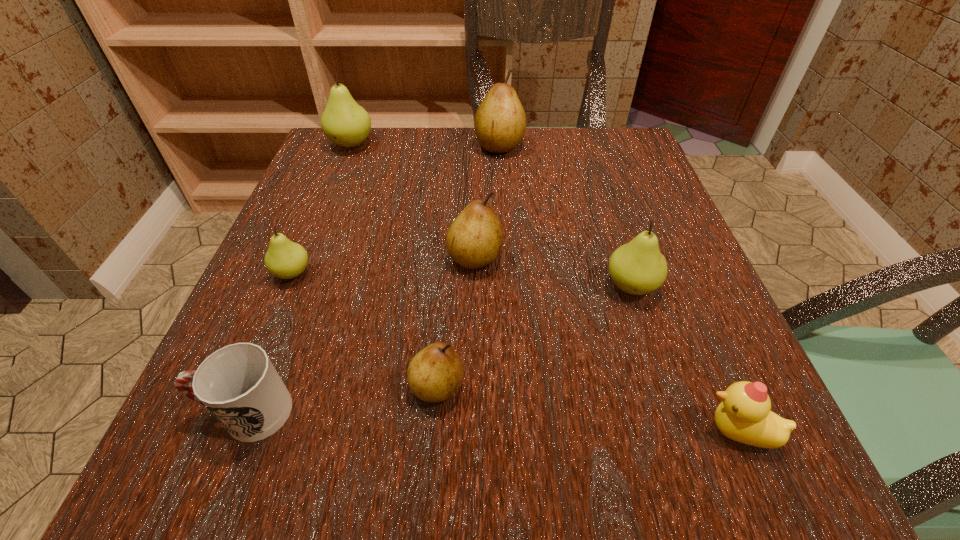
The width and height of the screenshot is (960, 540). Identify the location of cup at the near edge. (238, 384).

At what (x,y) coordinates should I click in order to perform the action: click on cup present at the left edge. Please return your answer as a coordinate pair (x, y). Looking at the image, I should click on (238, 384).

The image size is (960, 540). I want to click on pear that is at the right edge, so click(637, 268).

Where is `duckling that is at the right edge`? Image resolution: width=960 pixels, height=540 pixels. duckling that is at the right edge is located at coordinates pyautogui.click(x=744, y=415).

Where is `object present at the far left corner`? object present at the far left corner is located at coordinates (345, 123).

Locate an element on the screen. Image resolution: width=960 pixels, height=540 pixels. object that is positioned at the near left corner is located at coordinates (238, 384).

At what (x,y) coordinates should I click in order to perform the action: click on object that is at the near right corner. Please return your answer as a coordinate pair (x, y). Looking at the image, I should click on (744, 415).

The image size is (960, 540). Find the location of `vacant space at the far edge`. vacant space at the far edge is located at coordinates (446, 141).

In the image, there is a desktop. Where is `free space at the left edge`? free space at the left edge is located at coordinates (289, 294).

At what (x,y) coordinates should I click in order to perform the action: click on free location at the right edge of the desktop. Please return your answer as a coordinate pair (x, y). The image size is (960, 540). Looking at the image, I should click on (632, 217).